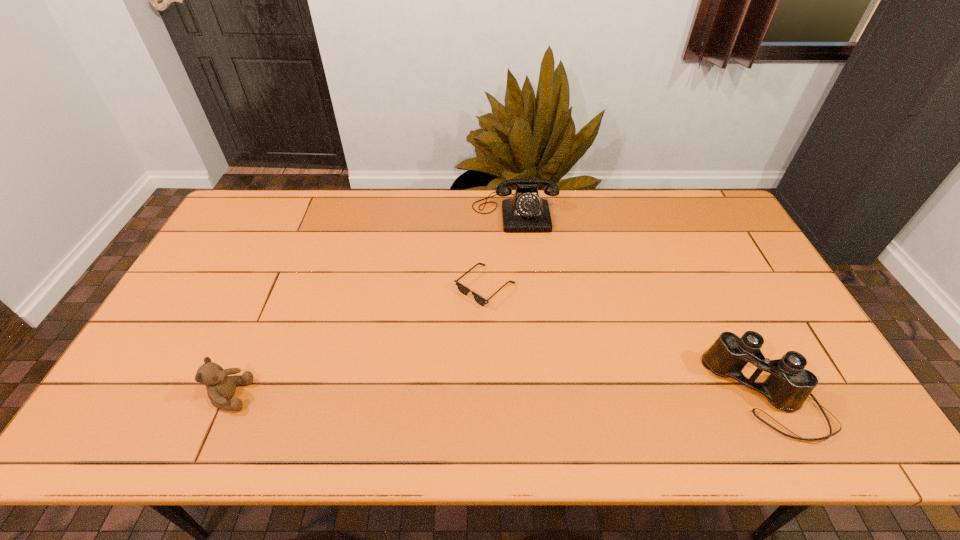
The image size is (960, 540). In order to click on free space between the third nearest object and the leftmost object in this screenshot , I will do `click(358, 341)`.

Identify the location of vacant area between the sunglasses and the teddy bear. (358, 341).

Image resolution: width=960 pixels, height=540 pixels. Find the location of `empty space that is in between the second farthest object and the farthest object`. empty space that is in between the second farthest object and the farthest object is located at coordinates (500, 249).

Choose which object is the second nearest neighbor to the rightmost object. Please provide its 2D coordinates. Your answer should be formatted as a tuple, i.e. [(x, y)], where the tuple contains the x and y coordinates of a point satisfying the conditions above.

[(525, 212)]

Identify which object is located as the nearest to the telephone. Please provide its 2D coordinates. Your answer should be formatted as a tuple, i.e. [(x, y)], where the tuple contains the x and y coordinates of a point satisfying the conditions above.

[(464, 290)]

Find the location of a particular element. The image size is (960, 540). vacant space that satisfies the following two spatial constraints: 1. on the front side of the sunglasses; 2. on the left side of the rightmost object is located at coordinates (486, 396).

I want to click on vacant point that satisfies the following two spatial constraints: 1. on the front side of the binoculars; 2. on the left side of the shortest object, so 486,396.

Identify the location of vacant space that satisfies the following two spatial constraints: 1. on the front side of the rightmost object; 2. on the right side of the farthest object. (531, 396).